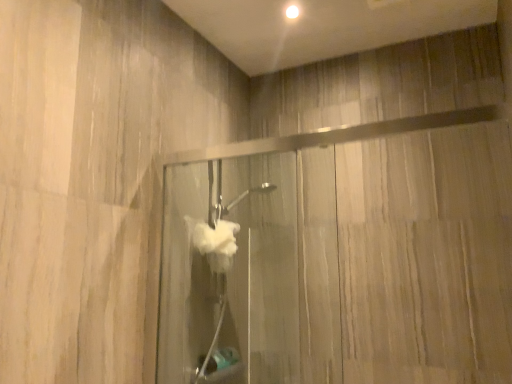
Question: Is transparent glass door at upper right thinner than translucent glass shower door at center?

Choices:
 (A) yes
 (B) no

Answer: (A)

Question: Is transparent glass door at upper right facing towards translucent glass shower door at center?

Choices:
 (A) no
 (B) yes

Answer: (A)

Question: From the image's perspective, would you say transparent glass door at upper right is positioned over translucent glass shower door at center?

Choices:
 (A) yes
 (B) no

Answer: (A)

Question: Considering the relative positions of transparent glass door at upper right and translucent glass shower door at center in the image provided, is transparent glass door at upper right to the left of translucent glass shower door at center from the viewer's perspective?

Choices:
 (A) yes
 (B) no

Answer: (B)

Question: Is transparent glass door at upper right at the right side of translucent glass shower door at center?

Choices:
 (A) no
 (B) yes

Answer: (B)

Question: Is transparent glass door at upper right facing away from translucent glass shower door at center?

Choices:
 (A) no
 (B) yes

Answer: (A)

Question: Considering the relative sizes of translucent glass shower door at center and transparent glass door at upper right in the image provided, is translucent glass shower door at center wider than transparent glass door at upper right?

Choices:
 (A) no
 (B) yes

Answer: (B)

Question: Is translucent glass shower door at center thinner than transparent glass door at upper right?

Choices:
 (A) no
 (B) yes

Answer: (A)

Question: Considering the relative positions of translucent glass shower door at center and transparent glass door at upper right in the image provided, is translucent glass shower door at center to the right of transparent glass door at upper right from the viewer's perspective?

Choices:
 (A) no
 (B) yes

Answer: (A)

Question: From the image's perspective, is translucent glass shower door at center on top of transparent glass door at upper right?

Choices:
 (A) yes
 (B) no

Answer: (B)

Question: Is translucent glass shower door at center not near transparent glass door at upper right?

Choices:
 (A) no
 (B) yes

Answer: (A)

Question: From a real-world perspective, is translucent glass shower door at center on transparent glass door at upper right?

Choices:
 (A) yes
 (B) no

Answer: (B)

Question: Would you say translucent glass shower door at center is to the left or to the right of transparent glass door at upper right in the picture?

Choices:
 (A) right
 (B) left

Answer: (B)